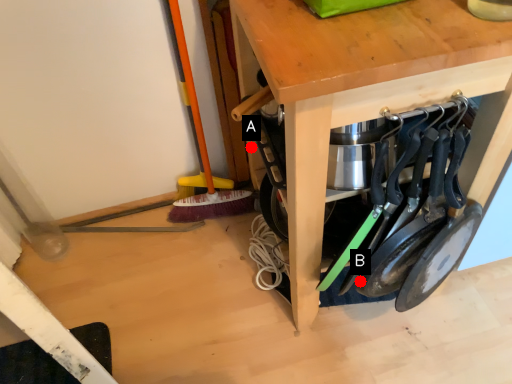
Question: Two points are circled on the image, labeled by A and B beside each circle. Which point is closer to the camera?

Choices:
 (A) A is closer
 (B) B is closer

Answer: (B)